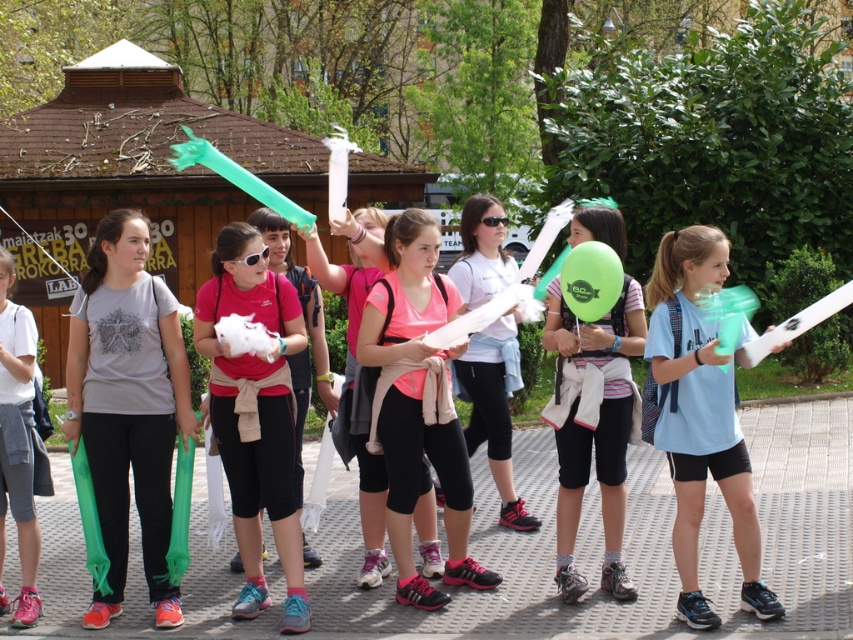
You are a photographer trying to capture a clear shot of the white cotton shirt at center without the matte green balloon at center blocking it. Since the balloon is bigger, where should you position yourself relative to the subjects?

The matte green balloon at center is bigger than the white cotton shirt at center, so positioning yourself behind the subjects would allow you to capture the white cotton shirt at center without the balloon obstructing the view.

You are standing at the origin point of the coordinate system in the image. Where is the matte green balloon at center located?

The matte green balloon at center is located at point (593, 424).

Based on the photo, you are a photographer trying to capture a group photo of the matte pink shirt at center and the pink matte tank top at center. Your camera can only focus on objects within a 1 meter range. Will both subjects be in focus?

The distance between the matte pink shirt at center and the pink matte tank top at center is 81.91 centimeters, which is less than 1 meter, so both subjects will be in focus.